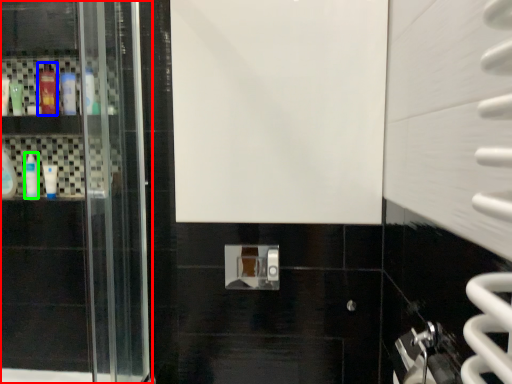
Question: Which object is positioned farthest from door (highlighted by a red box)? Select from mouthwash (highlighted by a blue box) and mouthwash (highlighted by a green box).

Choices:
 (A) mouthwash
 (B) mouthwash

Answer: (A)